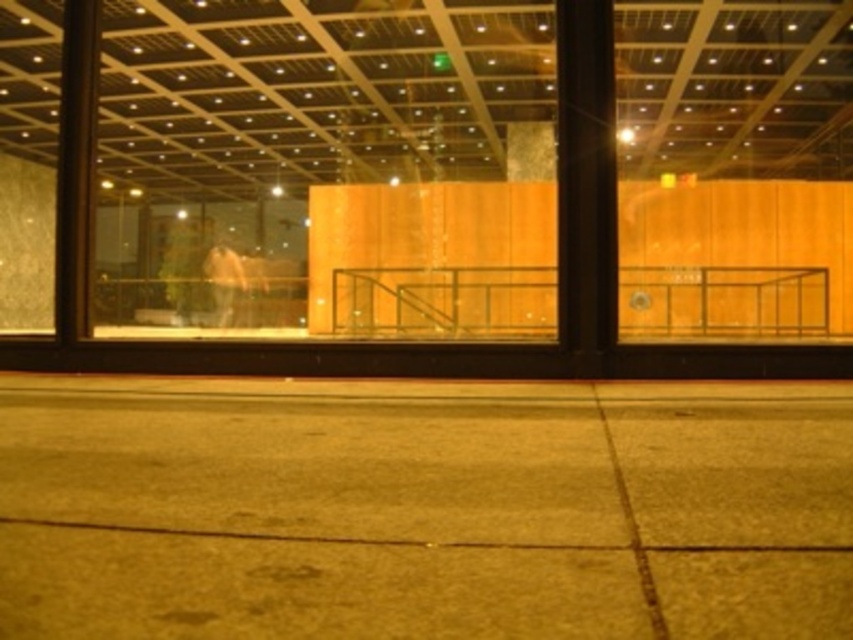
You are standing in the room and see the concrete pavement at center and the light brown leather jacket at center. Which object is positioned to the right of the other?

The concrete pavement at center is to the right of the light brown leather jacket at center.

You are standing at the entrance of the building and see the concrete pavement at center and the light brown leather jacket at center through the window. Which object is closer to you?

The concrete pavement at center is closer to you because it is positioned in front of the light brown leather jacket at center.

You are standing at the entrance of the building and see the concrete pavement at center and the light brown leather jacket at center through the window. Which object is closer to you?

The light brown leather jacket at center is closer to you because it is only 23.61 meters away from the concrete pavement at center, so the jacket is nearer than the pavement.